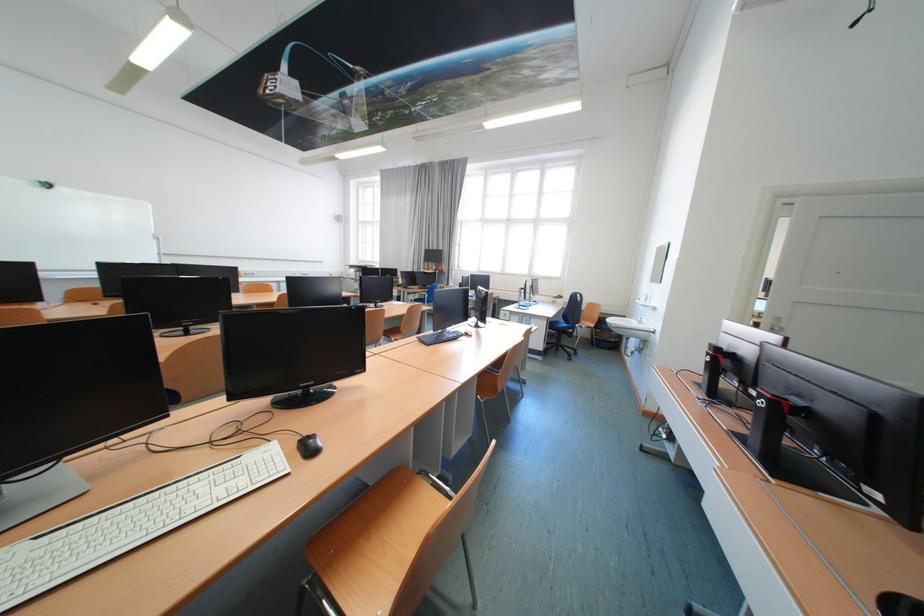
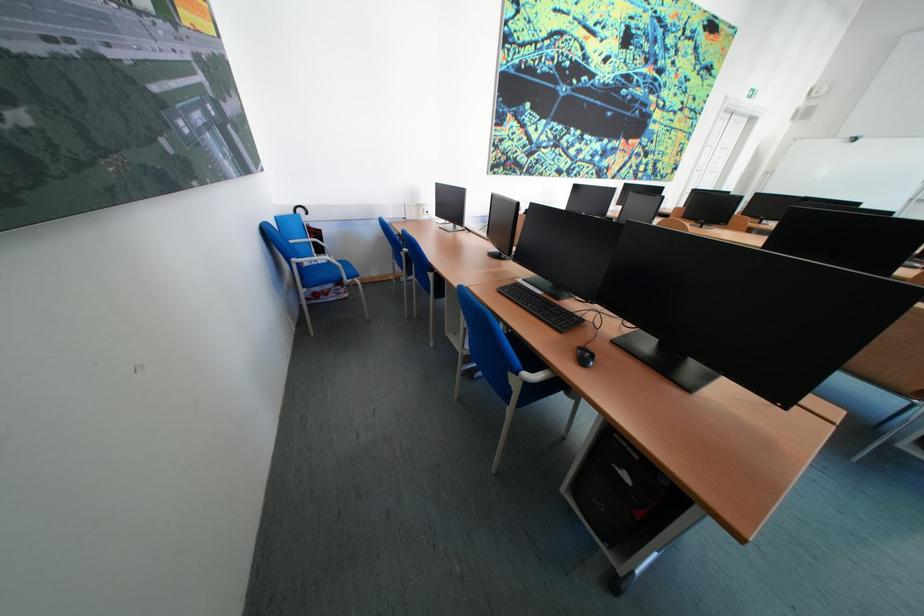
Question: I am providing you with two images of the same scene from different viewpoints. Please identify which objects are invisible in image2.

Choices:
 (A) white computer keyboard
 (B) blue chair armrest
 (C) black umbrella handle
 (D) white plush toy

Answer: (A)